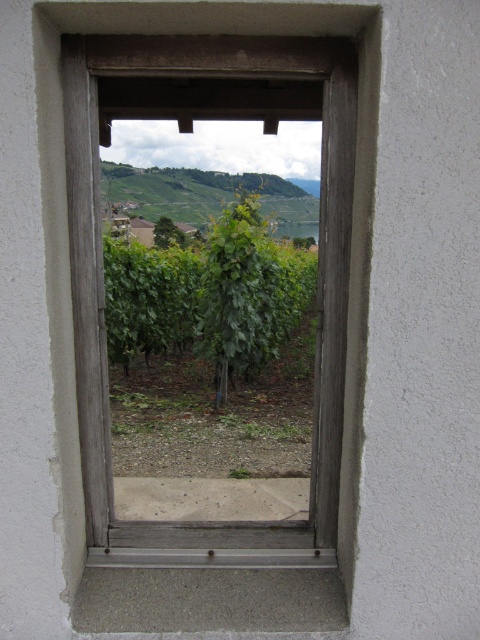
Question: Which object is closer to the camera taking this photo?

Choices:
 (A) wooden frame at center
 (B) green leafy vine at center

Answer: (A)

Question: Is wooden frame at center positioned in front of green leafy vine at center?

Choices:
 (A) yes
 (B) no

Answer: (A)

Question: Is wooden frame at center to the right of green leafy vine at center from the viewer's perspective?

Choices:
 (A) no
 (B) yes

Answer: (A)

Question: Where is wooden frame at center located in relation to green leafy vine at center in the image?

Choices:
 (A) above
 (B) below

Answer: (B)

Question: Which point is farther to the camera?

Choices:
 (A) wooden frame at center
 (B) green leafy vine at center

Answer: (B)